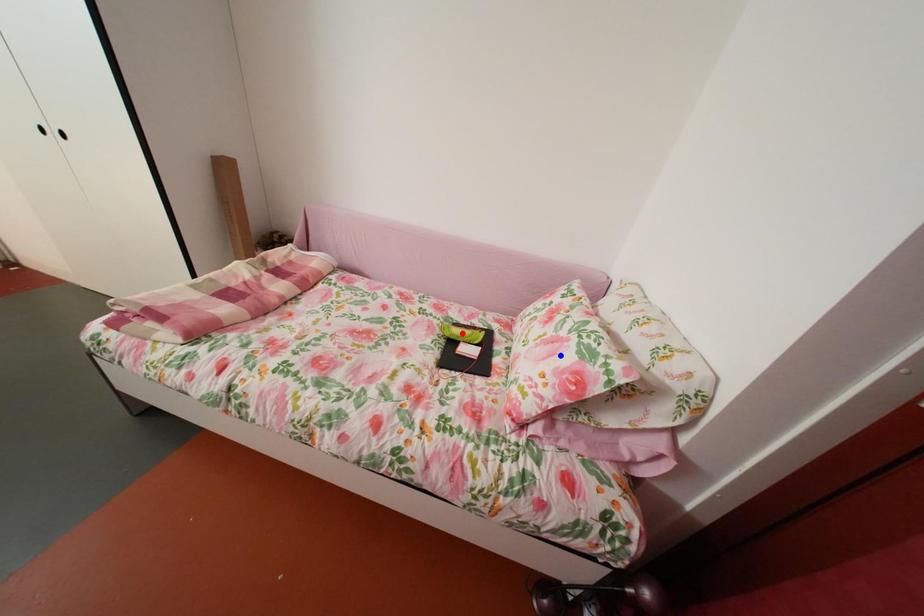
Question: Which of the two points in the image is closer to the camera?

Choices:
 (A) Blue point is closer.
 (B) Red point is closer.

Answer: (A)